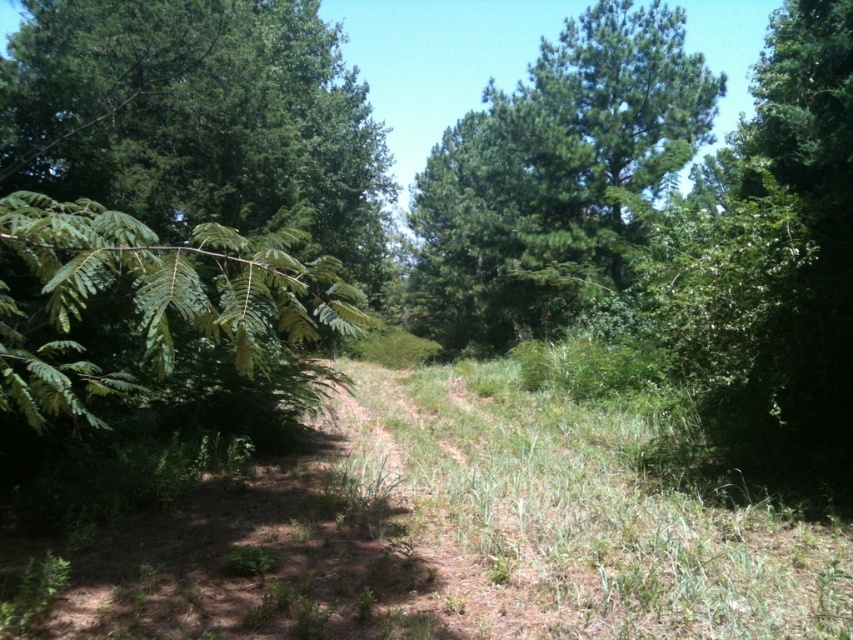
Question: Is green leafy branch at left smaller than green leafy tree at upper center?

Choices:
 (A) no
 (B) yes

Answer: (A)

Question: Is green leafy branch at left further to camera compared to green leafy tree at upper center?

Choices:
 (A) yes
 (B) no

Answer: (B)

Question: Which of the following is the closest to the observer?

Choices:
 (A) (602, 195)
 (B) (107, 131)

Answer: (B)

Question: Can you confirm if green leafy branch at left is positioned to the left of green leafy tree at upper center?

Choices:
 (A) yes
 (B) no

Answer: (A)

Question: Which of the following is the farthest from the observer?

Choices:
 (A) [x=612, y=164]
 (B) [x=265, y=83]

Answer: (A)